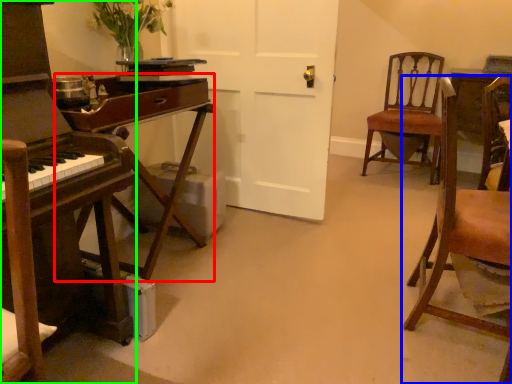
Question: Which is nearer to the table (highlighted by a red box)? chair (highlighted by a blue box) or desk (highlighted by a green box).

Choices:
 (A) chair
 (B) desk

Answer: (B)